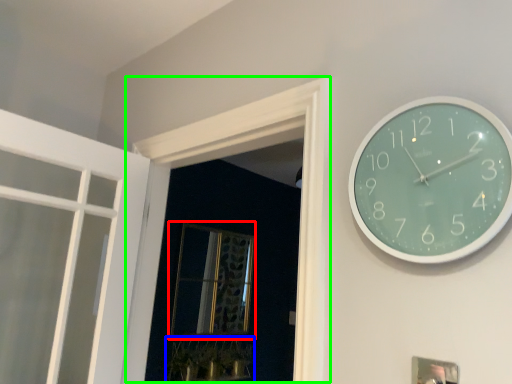
Question: Which is farther away from window (highlighted by a red box)? plant (highlighted by a blue box) or window frame (highlighted by a green box)?

Choices:
 (A) plant
 (B) window frame

Answer: (B)